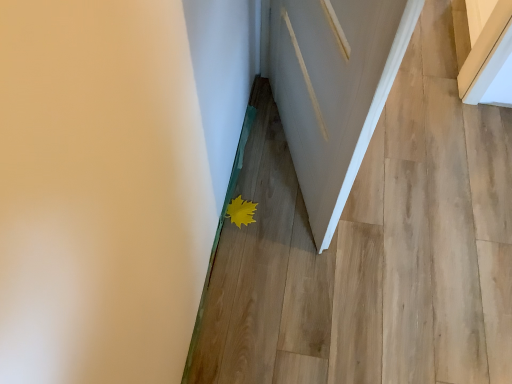
Question: From the image's perspective, is yellow matte leaf at lower center positioned above or below white wood door at center?

Choices:
 (A) below
 (B) above

Answer: (A)

Question: Looking at their shapes, would you say yellow matte leaf at lower center is wider or thinner than white wood door at center?

Choices:
 (A) thin
 (B) wide

Answer: (A)

Question: Which of these objects is positioned farthest from the yellow matte leaf at lower center?

Choices:
 (A) matte white door at lower center
 (B) white wood door at center

Answer: (B)

Question: Which is farther from the white wood door at center?

Choices:
 (A) matte white door at lower center
 (B) yellow matte leaf at lower center

Answer: (B)